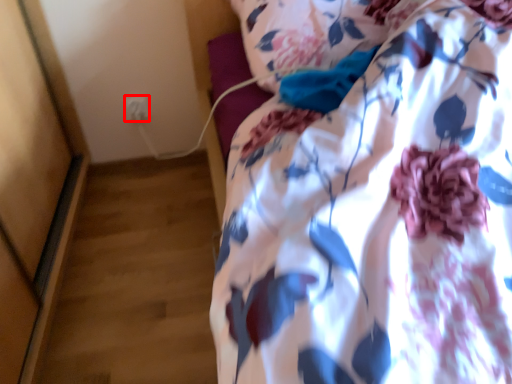
Question: From the image's perspective, where is electric outlet (annotated by the red box) located in relation to pillow in the image?

Choices:
 (A) below
 (B) above

Answer: (A)